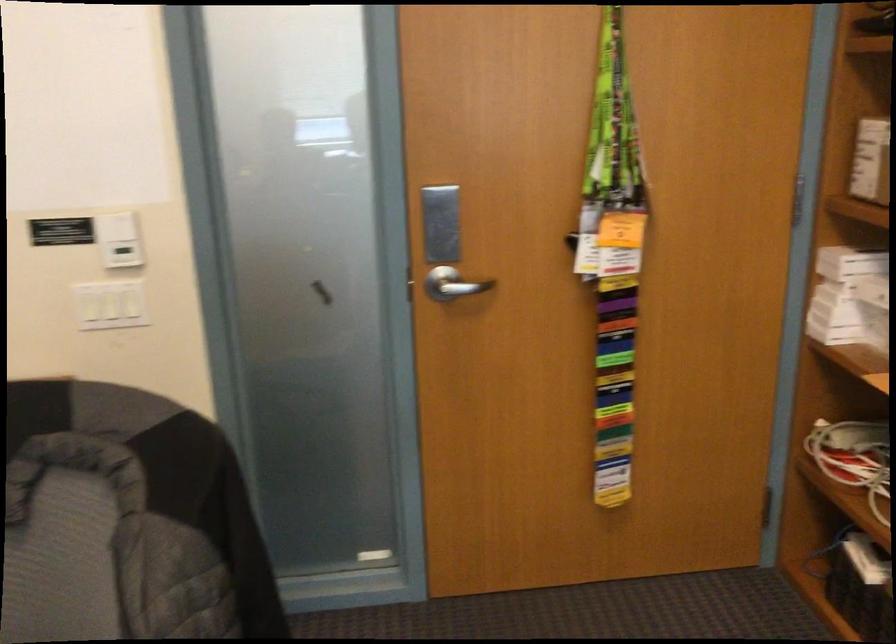
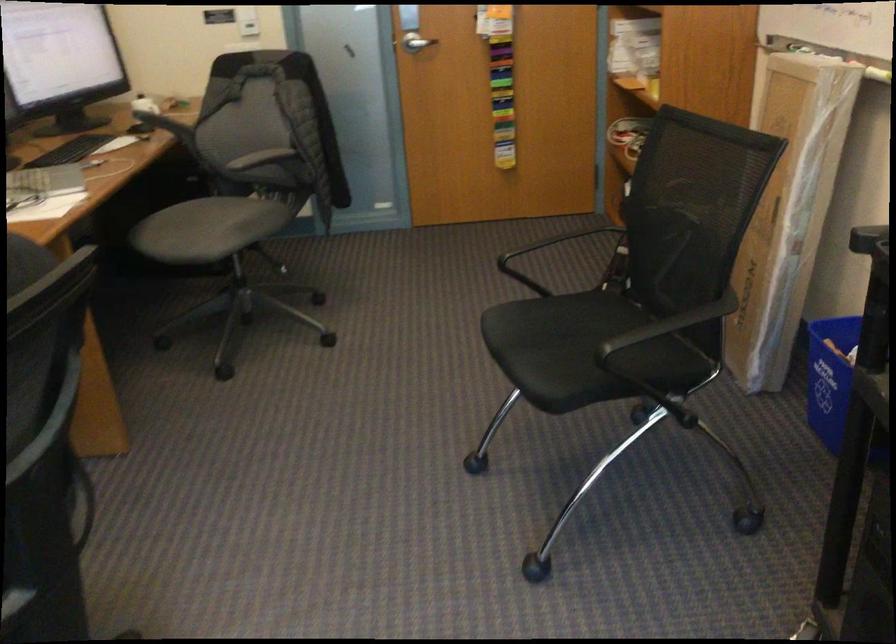
Locate, in the second image, the point that corresponds to the point at 449,310 in the first image.

(415, 43)